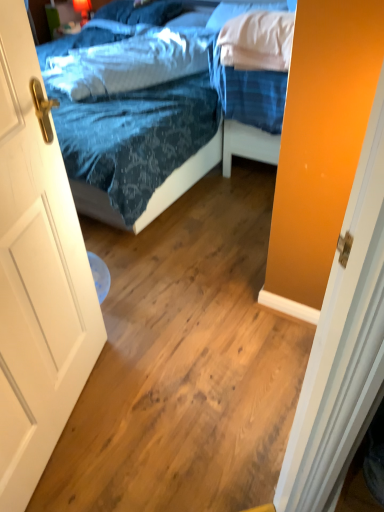
Question: Is the depth of blue fabric pillow at upper center, which is the 1th pillow in back-to-front order, less than that of white soft pillow at upper right, which appears as the second pillow when viewed from the back?

Choices:
 (A) yes
 (B) no

Answer: (B)

Question: From the image's perspective, is blue fabric pillow at upper center, which is the 1th pillow in back-to-front order, located above white soft pillow at upper right, which appears as the second pillow when viewed from the back?

Choices:
 (A) yes
 (B) no

Answer: (A)

Question: Can you confirm if blue fabric pillow at upper center, which is the 1th pillow in back-to-front order, is thinner than white soft pillow at upper right, which appears as the second pillow when viewed from the back?

Choices:
 (A) yes
 (B) no

Answer: (B)

Question: From a real-world perspective, is blue fabric pillow at upper center, arranged as the third pillow when viewed from the front, over white soft pillow at upper right, which appears as the second pillow when viewed from the back?

Choices:
 (A) no
 (B) yes

Answer: (A)

Question: Does blue fabric pillow at upper center, arranged as the third pillow when viewed from the front, come behind white soft pillow at upper right, which is the 2th pillow in front-to-back order?

Choices:
 (A) yes
 (B) no

Answer: (A)

Question: Looking at their shapes, would you say white wooden door at left is wider or thinner than blue textured pillow at upper center, the 3th pillow from the back?

Choices:
 (A) thin
 (B) wide

Answer: (A)

Question: From a real-world perspective, is white wooden door at left positioned above or below blue textured pillow at upper center, which is counted as the 1th pillow, starting from the front?

Choices:
 (A) below
 (B) above

Answer: (A)

Question: Is white wooden door at left taller or shorter than blue textured pillow at upper center, the 3th pillow from the back?

Choices:
 (A) tall
 (B) short

Answer: (A)

Question: Relative to blue textured pillow at upper center, the 3th pillow from the back, is white wooden door at left in front or behind?

Choices:
 (A) behind
 (B) front

Answer: (B)

Question: From the image's perspective, is blue fabric pillow at upper center, which is the 1th pillow in back-to-front order, located above or below white wooden door at left?

Choices:
 (A) above
 (B) below

Answer: (A)

Question: Looking at the image, does blue fabric pillow at upper center, arranged as the third pillow when viewed from the front, seem bigger or smaller compared to white wooden door at left?

Choices:
 (A) big
 (B) small

Answer: (B)

Question: Considering the relative positions of blue fabric pillow at upper center, which is the 1th pillow in back-to-front order, and white wooden door at left in the image provided, is blue fabric pillow at upper center, which is the 1th pillow in back-to-front order, to the left or to the right of white wooden door at left?

Choices:
 (A) right
 (B) left

Answer: (B)

Question: Is blue fabric pillow at upper center, arranged as the third pillow when viewed from the front, taller or shorter than white wooden door at left?

Choices:
 (A) tall
 (B) short

Answer: (B)

Question: From a real-world perspective, relative to blue fabric pillow at upper center, arranged as the third pillow when viewed from the front, is white wooden door at left vertically above or below?

Choices:
 (A) above
 (B) below

Answer: (B)

Question: Is white wooden door at left inside the boundaries of blue fabric pillow at upper center, arranged as the third pillow when viewed from the front, or outside?

Choices:
 (A) outside
 (B) inside

Answer: (A)